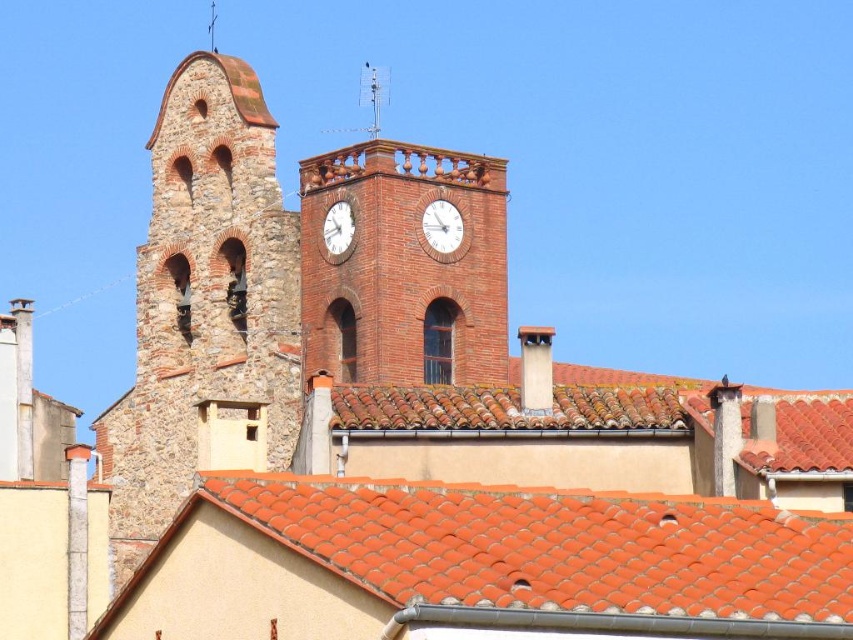
You are an architect visiting the town and want to install a new clock on the clock tower. There are two clocks available, the white glossy clock at upper center and the white matte clock at upper center. Which clock would you choose if you want to minimize the visual impact on the tower?

The white glossy clock at upper center occupies less space than the white matte clock at upper center, so choosing the white glossy clock at upper center would minimize the visual impact on the tower.

You are a tourist standing in front of the European town scene. You notice the brick clock tower at center and the white matte clock at upper center. Which object is wider?

The brick clock tower at center is wider than the white matte clock at upper center.